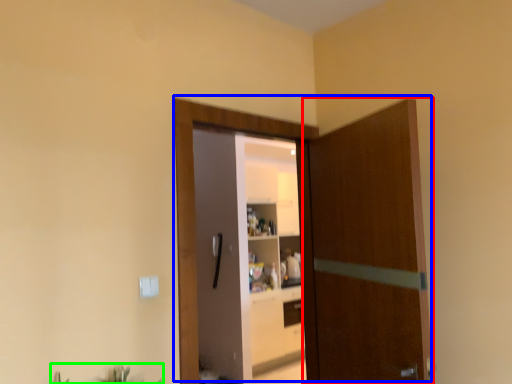
Question: Considering the real-world distances, which object is closest to door (highlighted by a red box)? door (highlighted by a blue box) or plant (highlighted by a green box).

Choices:
 (A) door
 (B) plant

Answer: (A)